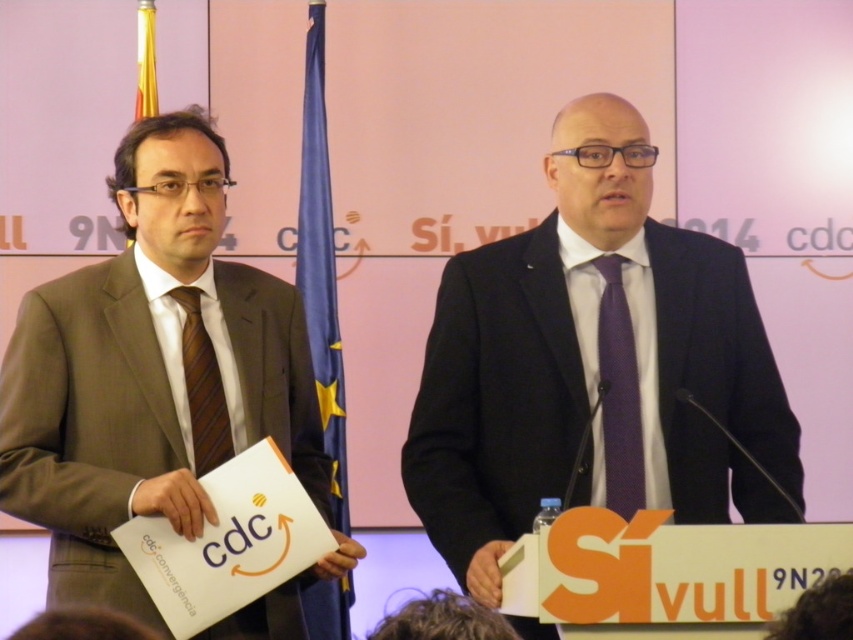
You are a fashion designer observing the two men at the podium. Which tie, the purple silk tie at center or the brownstriped fabrictie at left, would you recommend for a client who prefers a bold and attention grabbing look?

The purple silk tie at center is larger in size than the brownstriped fabrictie at left, making it more suitable for a bold and attention grabbing look.